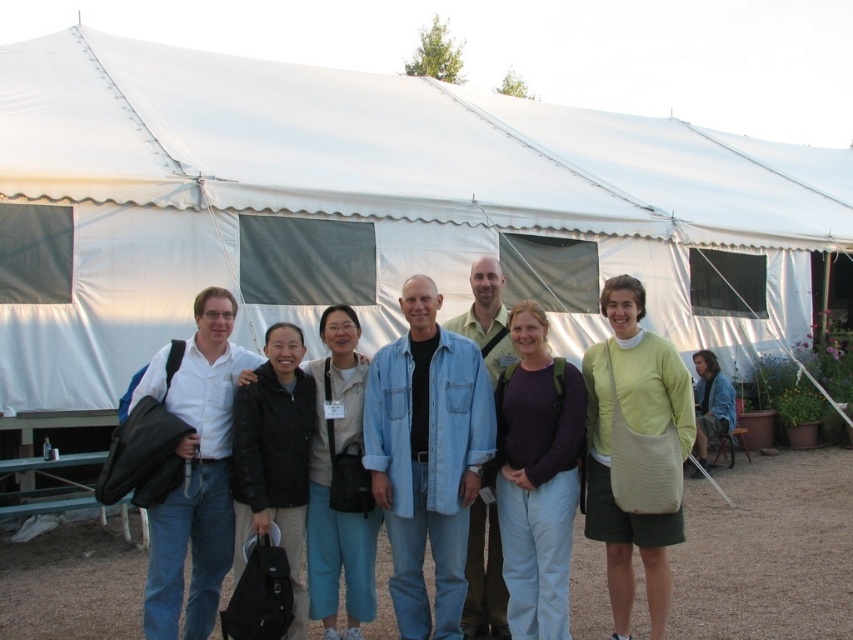
Can you confirm if matte white shirt at center is positioned to the left of denim jacket at lower right?

Yes, matte white shirt at center is to the left of denim jacket at lower right.

Can you confirm if matte white shirt at center is positioned above denim jacket at lower right?

Yes, matte white shirt at center is above denim jacket at lower right.

The height and width of the screenshot is (640, 853). Find the location of `matte white shirt at center`. matte white shirt at center is located at coordinates (195, 472).

Does light green woven bag at center appear on the right side of denim jacket at lower right?

Incorrect, light green woven bag at center is not on the right side of denim jacket at lower right.

Between light green woven bag at center and denim jacket at lower right, which one has less height?

denim jacket at lower right is shorter.

Who is more distant from viewer, (619,541) or (706,355)?

The point (706,355) is behind.

Where is `light green woven bag at center`? light green woven bag at center is located at coordinates (641, 433).

Is light green woven bag at center further to the viewer compared to black matte jacket at center?

Yes, light green woven bag at center is further from the viewer.

From the picture: Between light green woven bag at center and black matte jacket at center, which one has more height?

light green woven bag at center is taller.

At what (x,y) coordinates should I click in order to perform the action: click on light green woven bag at center. Please return your answer as a coordinate pair (x, y). The image size is (853, 640). Looking at the image, I should click on (641, 433).

What are the coordinates of `light green woven bag at center` in the screenshot? It's located at (641, 433).